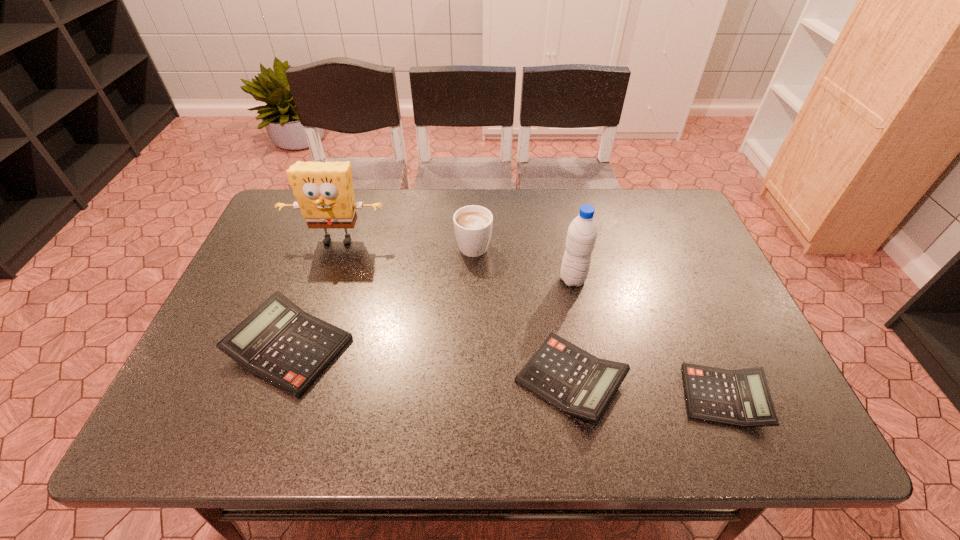
Where is `object at the far left corner`? The image size is (960, 540). object at the far left corner is located at coordinates [x=324, y=191].

The width and height of the screenshot is (960, 540). What are the coordinates of `object that is at the near left corner` in the screenshot? It's located at (280, 343).

The width and height of the screenshot is (960, 540). What are the coordinates of `object at the near right corner` in the screenshot? It's located at (741, 398).

Find the location of a particular element. free space at the far edge of the desktop is located at coordinates (398, 199).

The height and width of the screenshot is (540, 960). What are the coordinates of `vacant space at the near edge` in the screenshot? It's located at (661, 385).

Identify the location of free space at the left edge of the desktop. The image size is (960, 540). (230, 308).

Locate an element on the screen. vacant region at the right edge of the desktop is located at coordinates click(x=698, y=254).

Identify the location of vacant space at the far right corner. The image size is (960, 540). (676, 217).

Locate an element on the screen. This screenshot has height=540, width=960. vacant area that lies between the sponge and the second shortest object is located at coordinates click(454, 310).

This screenshot has width=960, height=540. Find the location of `free space between the sponge and the rightmost object`. free space between the sponge and the rightmost object is located at coordinates [x=531, y=319].